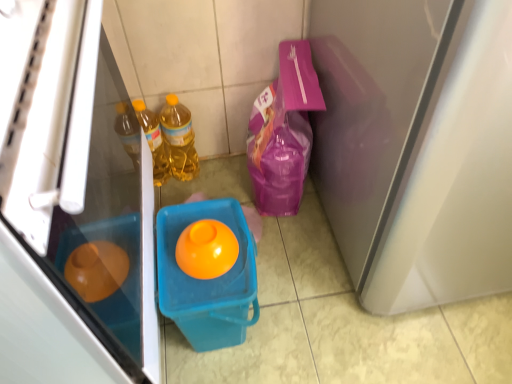
Describe the element at coordinates (206, 249) in the screenshot. Image resolution: width=512 pixels, height=384 pixels. I see `orange glossy egg at center` at that location.

How much space does translucent yellow bottle at center, acting as the first bottle starting from the right, occupy horizontally?

translucent yellow bottle at center, acting as the first bottle starting from the right, is 3.66 inches in width.

What is the approximate width of translucent yellow bottle at left, the first bottle when ordered from left to right?

The width of translucent yellow bottle at left, the first bottle when ordered from left to right, is 3.70 inches.

Find the location of `translucent yellow bottle at left, the first bottle when ordered from left to right`. translucent yellow bottle at left, the first bottle when ordered from left to right is located at coordinates (153, 142).

In order to face translucent plastic bucket at center, should I rotate leftwards or rightwards?

A 5.725 degree turn to the left will do.

Identify the location of orange glossy egg at center. (206, 249).

Can you confirm if translucent yellow bottle at left, the second bottle viewed from the right, is taller than matte white screen door at right?

Incorrect, the height of translucent yellow bottle at left, the second bottle viewed from the right, is not larger of that of matte white screen door at right.

How different are the orientations of translucent yellow bottle at left, the first bottle when ordered from left to right, and matte white screen door at right in degrees?

translucent yellow bottle at left, the first bottle when ordered from left to right, and matte white screen door at right are facing 1.76 degrees away from each other.

Which of these two, translucent yellow bottle at left, the first bottle when ordered from left to right, or matte white screen door at right, is wider?

With larger width is matte white screen door at right.

Is translucent yellow bottle at left, the second bottle viewed from the right, at the left side of matte white screen door at right?

Yes, translucent yellow bottle at left, the second bottle viewed from the right, is to the left of matte white screen door at right.

Does point (341, 25) lie behind point (184, 229)?

Yes, it is.

From the image's perspective, is matte white screen door at right located beneath orange glossy egg at center?

Actually, matte white screen door at right appears above orange glossy egg at center in the image.

Are matte white screen door at right and orange glossy egg at center beside each other?

They are not placed beside each other.

Which of these two, matte white screen door at right or orange glossy egg at center, stands shorter?

Standing shorter between the two is orange glossy egg at center.

Is translucent yellow bottle at left, the second bottle viewed from the right, surrounded by matte white screen door at right?

No, translucent yellow bottle at left, the second bottle viewed from the right, is not surrounded by matte white screen door at right.

From a real-world perspective, is matte white screen door at right over translucent yellow bottle at left, the first bottle when ordered from left to right?

Indeed, from a real-world perspective, matte white screen door at right stands above translucent yellow bottle at left, the first bottle when ordered from left to right.

Considering the sizes of objects matte white screen door at right and translucent yellow bottle at left, the second bottle viewed from the right, in the image provided, who is shorter, matte white screen door at right or translucent yellow bottle at left, the second bottle viewed from the right,?

With less height is translucent yellow bottle at left, the second bottle viewed from the right.

Would you consider matte white screen door at right to be distant from translucent yellow bottle at left, the first bottle when ordered from left to right?

No, matte white screen door at right is in close proximity to translucent yellow bottle at left, the first bottle when ordered from left to right.

In the scene shown: Could you tell me if matte plastic refrigerator at left is facing translucent plastic bucket at center?

Yes, matte plastic refrigerator at left is oriented towards translucent plastic bucket at center.

Is matte plastic refrigerator at left next to translucent plastic bucket at center and touching it?

No, matte plastic refrigerator at left is not with translucent plastic bucket at center.

Is matte plastic refrigerator at left bigger than translucent plastic bucket at center?

Correct, matte plastic refrigerator at left is larger in size than translucent plastic bucket at center.

Which is correct: matte plastic refrigerator at left is inside translucent yellow bottle at center, acting as the first bottle starting from the right, or outside of it?

matte plastic refrigerator at left is spatially situated outside translucent yellow bottle at center, acting as the first bottle starting from the right.

Find the location of a particular element. Image resolution: width=512 pixels, height=384 pixels. refrigerator that appears on the left of translucent yellow bottle at center, acting as the first bottle starting from the right is located at coordinates (71, 205).

Which is in front, point (153, 150) or point (223, 271)?

The point (223, 271) is closer to the camera.

Consider the image. Is translucent yellow bottle at left, the second bottle viewed from the right, positioned before orange glossy egg at center?

That is False.

From the picture: Looking at the image, does translucent yellow bottle at left, the first bottle when ordered from left to right, seem bigger or smaller compared to orange glossy egg at center?

In the image, translucent yellow bottle at left, the first bottle when ordered from left to right, appears to be larger than orange glossy egg at center.

Does orange glossy egg at center have a larger size compared to matte plastic refrigerator at left?

Incorrect, orange glossy egg at center is not larger than matte plastic refrigerator at left.

Considering their positions, is orange glossy egg at center located in front of or behind matte plastic refrigerator at left?

In the image, orange glossy egg at center appears behind matte plastic refrigerator at left.

This screenshot has height=384, width=512. I want to click on egg located underneath the matte plastic refrigerator at left (from a real-world perspective), so click(x=206, y=249).

Could you tell me if orange glossy egg at center is turned towards matte plastic refrigerator at left?

No, orange glossy egg at center is not oriented towards matte plastic refrigerator at left.

From the image's perspective, which bottle is the 2nd one below the matte white screen door at right? Please provide its 2D coordinates.

[(153, 142)]

The width and height of the screenshot is (512, 384). I want to click on screen door above the orange glossy egg at center (from a real-world perspective), so click(373, 108).

Considering their positions, is translucent plastic bucket at center positioned closer to matte plastic refrigerator at left than translucent yellow bottle at left, the first bottle when ordered from left to right?

The object closer to matte plastic refrigerator at left is translucent plastic bucket at center.

Estimate the real-world distances between objects in this image. Which object is further from matte white screen door at right, translucent yellow bottle at left, the second bottle viewed from the right, or translucent plastic bucket at center?

translucent yellow bottle at left, the second bottle viewed from the right, is further to matte white screen door at right.

When comparing their distances from orange glossy egg at center, does matte plastic refrigerator at left or matte white screen door at right seem further?

The object further to orange glossy egg at center is matte white screen door at right.

Looking at the image, which one is located closer to matte white screen door at right, matte plastic refrigerator at left or orange glossy egg at center?

→ orange glossy egg at center is positioned closer to the anchor matte white screen door at right.

Estimate the real-world distances between objects in this image. Which object is closer to matte white screen door at right, translucent plastic bucket at center or translucent yellow bottle at left, the first bottle when ordered from left to right?

Among the two, translucent plastic bucket at center is located nearer to matte white screen door at right.

Consider the image. From the image, which object appears to be farther from translucent yellow bottle at center, marked as the 2th bottle in a left-to-right arrangement, orange glossy egg at center or matte plastic refrigerator at left?

matte plastic refrigerator at left lies further to translucent yellow bottle at center, marked as the 2th bottle in a left-to-right arrangement, than the other object.

Which object lies further to the anchor point matte white screen door at right, matte plastic refrigerator at left or translucent yellow bottle at left, the first bottle when ordered from left to right?

Among the two, translucent yellow bottle at left, the first bottle when ordered from left to right, is located further to matte white screen door at right.

Based on the photo, which object lies nearer to the anchor point orange glossy egg at center, matte white screen door at right or translucent yellow bottle at left, the second bottle viewed from the right?

The object closer to orange glossy egg at center is matte white screen door at right.

Locate an element on the screen. The image size is (512, 384). egg between matte plastic refrigerator at left and translucent plastic bucket at center from front to back is located at coordinates (206, 249).

Locate an element on the screen. recycling bin between matte plastic refrigerator at left and translucent yellow bottle at left, the first bottle when ordered from left to right, in the front-back direction is located at coordinates (207, 272).

I want to click on egg situated between translucent plastic bucket at center and matte white screen door at right from left to right, so click(x=206, y=249).

The width and height of the screenshot is (512, 384). Identify the location of recycling bin located between translucent yellow bottle at left, the first bottle when ordered from left to right, and matte white screen door at right in the left-right direction. (207, 272).